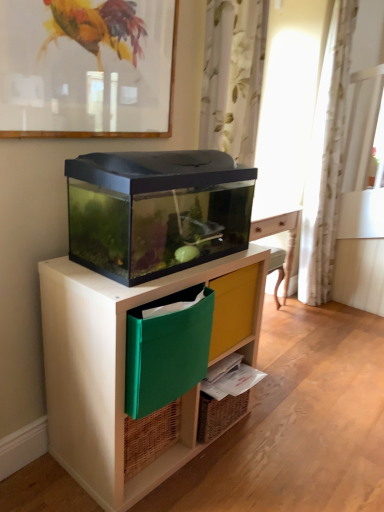
Where is `matte glass picture frame at upper center`? The height and width of the screenshot is (512, 384). matte glass picture frame at upper center is located at coordinates (87, 68).

Measure the distance between point (111, 484) and camera.

Point (111, 484) is 4.37 feet from camera.

Measure the distance between matte black aquarium at center and camera.

matte black aquarium at center is 1.12 meters from camera.

This screenshot has width=384, height=512. I want to click on white floral fabric curtain at upper center, which is counted as the 2th curtain, starting from the right, so click(x=232, y=76).

The width and height of the screenshot is (384, 512). Describe the element at coordinates (326, 161) in the screenshot. I see `white floral fabric curtain at right, which appears as the 2th curtain when viewed from the left` at that location.

Image resolution: width=384 pixels, height=512 pixels. Find the location of `green fabric file at lower center`. green fabric file at lower center is located at coordinates tap(167, 349).

This screenshot has width=384, height=512. I want to click on matte glass picture frame at upper center, so click(x=87, y=68).

Considering the points (168, 335) and (323, 293), which point is in front, point (168, 335) or point (323, 293)?

Positioned in front is point (168, 335).

From a real-world perspective, is green fabric file at lower center physically above white floral fabric curtain at upper center, which is counted as the 2th curtain, starting from the right?

No.

Is green fabric file at lower center inside the boundaries of white floral fabric curtain at upper center, which is counted as the 2th curtain, starting from the right, or outside?

The correct answer is: outside.

From a real-world perspective, is white floral fabric curtain at upper center, the second curtain from the back, on matte black aquarium at center?

Indeed, from a real-world perspective, white floral fabric curtain at upper center, the second curtain from the back, stands above matte black aquarium at center.

Do you think white floral fabric curtain at upper center, the first curtain when ordered from front to back, is within matte black aquarium at center, or outside of it?

white floral fabric curtain at upper center, the first curtain when ordered from front to back, lies outside matte black aquarium at center.

Does white floral fabric curtain at upper center, the first curtain when ordered from front to back, have a greater width compared to matte black aquarium at center?

No.

Is white floral fabric curtain at upper center, the second curtain from the back, directly adjacent to matte black aquarium at center?

No.

How much distance is there between white floral fabric curtain at upper center, which is counted as the 2th curtain, starting from the right, and green fabric file at lower center?

white floral fabric curtain at upper center, which is counted as the 2th curtain, starting from the right, is 6.08 feet from green fabric file at lower center.

Is white floral fabric curtain at upper center, which is counted as the 1th curtain, starting from the left, placed right next to green fabric file at lower center?

No, white floral fabric curtain at upper center, which is counted as the 1th curtain, starting from the left, is not next to green fabric file at lower center.

From the picture: Relative to green fabric file at lower center, is white floral fabric curtain at upper center, which is counted as the 2th curtain, starting from the right, in front or behind?

In the image, white floral fabric curtain at upper center, which is counted as the 2th curtain, starting from the right, appears behind green fabric file at lower center.

Looking at their sizes, would you say white floral fabric curtain at upper center, the first curtain when ordered from front to back, is wider or thinner than green fabric file at lower center?

Considering their sizes, white floral fabric curtain at upper center, the first curtain when ordered from front to back, looks slimmer than green fabric file at lower center.

Considering the sizes of objects white floral fabric curtain at upper center, the first curtain when ordered from front to back, and matte glass picture frame at upper center in the image provided, who is taller, white floral fabric curtain at upper center, the first curtain when ordered from front to back, or matte glass picture frame at upper center?

white floral fabric curtain at upper center, the first curtain when ordered from front to back.

Would you say white floral fabric curtain at upper center, which is counted as the 2th curtain, starting from the right, is outside matte glass picture frame at upper center?

Yes, white floral fabric curtain at upper center, which is counted as the 2th curtain, starting from the right, is not within matte glass picture frame at upper center.

Which of these two, white floral fabric curtain at upper center, the first curtain when ordered from front to back, or matte glass picture frame at upper center, is thinner?

With smaller width is matte glass picture frame at upper center.

Identify the location of picture frame on the left side of green fabric file at lower center. (87, 68).

Is matte glass picture frame at upper center aimed at green fabric file at lower center?

No, matte glass picture frame at upper center does not turn towards green fabric file at lower center.

Would you say matte glass picture frame at upper center is to the left or to the right of green fabric file at lower center in the picture?

In the image, matte glass picture frame at upper center appears on the left side of green fabric file at lower center.

Relative to green fabric file at lower center, is matte glass picture frame at upper center in front or behind?

Clearly, matte glass picture frame at upper center is in front of green fabric file at lower center.

In the scene shown: Is matte glass picture frame at upper center placed right next to matte black aquarium at center?

matte glass picture frame at upper center and matte black aquarium at center are clearly separated.

From the image's perspective, which one is positioned higher, matte glass picture frame at upper center or matte black aquarium at center?

matte glass picture frame at upper center appears higher in the image.

In the scene shown: In terms of width, does matte glass picture frame at upper center look wider or thinner when compared to matte black aquarium at center?

matte glass picture frame at upper center is thinner than matte black aquarium at center.

From a real-world perspective, is matte glass picture frame at upper center above or below matte black aquarium at center?

matte glass picture frame at upper center is above matte black aquarium at center.

From the image's perspective, would you say matte black aquarium at center is shown under green fabric file at lower center?

Yes, from the image's perspective, matte black aquarium at center is beneath green fabric file at lower center.

How many degrees apart are the facing directions of matte black aquarium at center and green fabric file at lower center?

The angular difference between matte black aquarium at center and green fabric file at lower center is 0.537 degrees.

Does matte black aquarium at center appear on the right side of green fabric file at lower center?

No, matte black aquarium at center is not to the right of green fabric file at lower center.

Does matte black aquarium at center touch green fabric file at lower center?

They are not placed beside each other.

Find the location of a particular element. The image size is (384, 512). storage box in front of the white floral fabric curtain at upper center, which is counted as the 2th curtain, starting from the right is located at coordinates (167, 349).

The height and width of the screenshot is (512, 384). Find the location of `desk below the white floral fabric curtain at upper center, which is counted as the 2th curtain, starting from the right (from a real-world perspective)`. desk below the white floral fabric curtain at upper center, which is counted as the 2th curtain, starting from the right (from a real-world perspective) is located at coordinates (124, 364).

Estimate the real-world distances between objects in this image. Which object is further from white floral fabric curtain at upper center, which is counted as the 1th curtain, starting from the left, white floral fabric curtain at right, which ranks as the 1th curtain in back-to-front order, or matte glass picture frame at upper center?

matte glass picture frame at upper center lies further to white floral fabric curtain at upper center, which is counted as the 1th curtain, starting from the left, than the other object.

Based on their spatial positions, is green fabric file at lower center or matte black aquarium at center further from matte glass picture frame at upper center?

green fabric file at lower center.

Looking at the image, which one is located closer to matte glass picture frame at upper center, white floral fabric curtain at right, marked as the second curtain in a front-to-back arrangement, or green fabric file at lower center?

green fabric file at lower center is positioned closer to the anchor matte glass picture frame at upper center.

Which object lies further to the anchor point white floral fabric curtain at right, acting as the 1th curtain starting from the right, white floral fabric curtain at upper center, which is counted as the 1th curtain, starting from the left, or green fabric file at lower center?

Among the two, green fabric file at lower center is located further to white floral fabric curtain at right, acting as the 1th curtain starting from the right.

When comparing their distances from white floral fabric curtain at upper center, which is counted as the 1th curtain, starting from the left, does matte black aquarium at center or white floral fabric curtain at right, acting as the 1th curtain starting from the right, seem closer?

white floral fabric curtain at right, acting as the 1th curtain starting from the right, is positioned closer to the anchor white floral fabric curtain at upper center, which is counted as the 1th curtain, starting from the left.

When comparing their distances from green fabric file at lower center, does matte glass picture frame at upper center or white floral fabric curtain at right, marked as the second curtain in a front-to-back arrangement, seem closer?

Among the two, matte glass picture frame at upper center is located nearer to green fabric file at lower center.

Considering their positions, is matte black aquarium at center positioned further to green fabric file at lower center than white floral fabric curtain at right, which ranks as the 1th curtain in back-to-front order?

Among the two, white floral fabric curtain at right, which ranks as the 1th curtain in back-to-front order, is located further to green fabric file at lower center.

When comparing their distances from matte glass picture frame at upper center, does green fabric file at lower center or white floral fabric curtain at right, which appears as the 2th curtain when viewed from the left, seem closer?

green fabric file at lower center lies closer to matte glass picture frame at upper center than the other object.

Where is `curtain between green fabric file at lower center and white floral fabric curtain at right, which appears as the 2th curtain when viewed from the left, along the z-axis`? curtain between green fabric file at lower center and white floral fabric curtain at right, which appears as the 2th curtain when viewed from the left, along the z-axis is located at coordinates (232, 76).

Locate an element on the screen. Image resolution: width=384 pixels, height=512 pixels. curtain between matte glass picture frame at upper center and white floral fabric curtain at right, which ranks as the 1th curtain in back-to-front order, along the z-axis is located at coordinates (232, 76).

Where is `desk located between matte glass picture frame at upper center and white floral fabric curtain at right, marked as the second curtain in a front-to-back arrangement, in the depth direction`? desk located between matte glass picture frame at upper center and white floral fabric curtain at right, marked as the second curtain in a front-to-back arrangement, in the depth direction is located at coordinates (124, 364).

This screenshot has width=384, height=512. In order to click on curtain between matte black aquarium at center and white floral fabric curtain at right, acting as the 1th curtain starting from the right, in the front-back direction in this screenshot , I will do [232, 76].